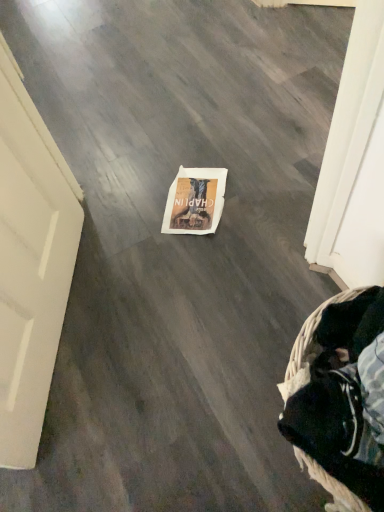
The height and width of the screenshot is (512, 384). In order to click on free space behind woven fabric basket at lower right in this screenshot , I will do `click(254, 304)`.